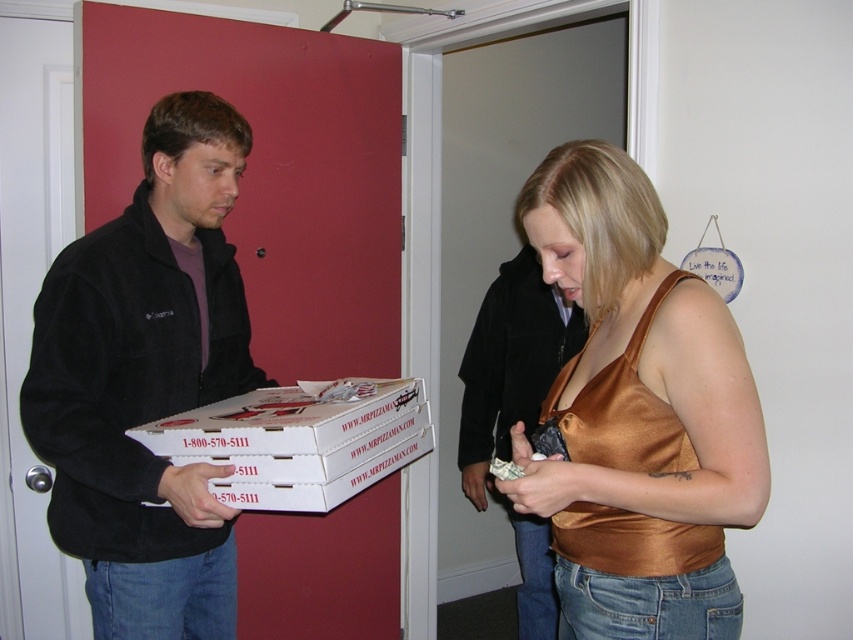
Question: Is black fleece jacket at left positioned at the back of white cardboard box at center?

Choices:
 (A) no
 (B) yes

Answer: (B)

Question: Which point is closer to the camera taking this photo?

Choices:
 (A) (289, 428)
 (B) (155, 465)
 (C) (614, 262)

Answer: (C)

Question: Can you confirm if gold satin tank top at center is bigger than white cardboard box at center?

Choices:
 (A) no
 (B) yes

Answer: (B)

Question: Which object is the farthest from the black fleece jacket at left?

Choices:
 (A) white cardboard box at center
 (B) gold satin tank top at center

Answer: (B)

Question: Which of the following is the closest to the observer?

Choices:
 (A) (578, 388)
 (B) (96, 512)

Answer: (A)

Question: Is the position of gold satin tank top at center less distant than that of black fleece jacket at left?

Choices:
 (A) no
 (B) yes

Answer: (B)